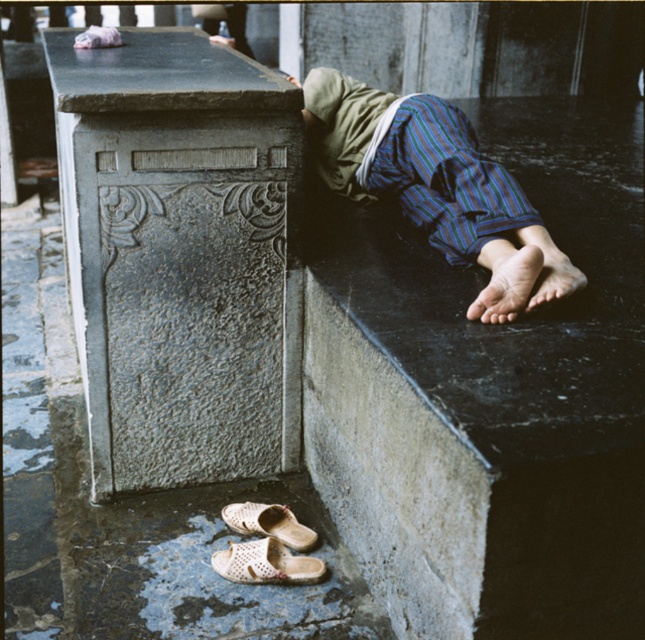
Question: Based on their relative distances, which object is nearer to the black marble concrete at upper right?

Choices:
 (A) white mesh shoe at lower left
 (B) dry skin foot at lower right
 (C) white woven sandal at lower center
 (D) striped fabric legs at lower right

Answer: (D)

Question: Which of the following is the closest to the observer?

Choices:
 (A) (243, 566)
 (B) (370, 374)
 (C) (239, 524)
 (D) (511, 266)

Answer: (B)

Question: Considering the relative positions of dry skin foot at lower right and white woven sandal at lower center in the image provided, where is dry skin foot at lower right located with respect to white woven sandal at lower center?

Choices:
 (A) left
 (B) right

Answer: (B)

Question: From the image, what is the correct spatial relationship of black marble concrete at upper right in relation to striped fabric legs at lower right?

Choices:
 (A) right
 (B) left

Answer: (A)

Question: Which object appears farthest from the camera in this image?

Choices:
 (A) black marble concrete at upper right
 (B) striped fabric legs at lower right
 (C) dry skin foot at lower right
 (D) white woven sandal at lower center

Answer: (D)

Question: Does black marble concrete at upper right have a greater width compared to white mesh shoe at lower left?

Choices:
 (A) no
 (B) yes

Answer: (B)